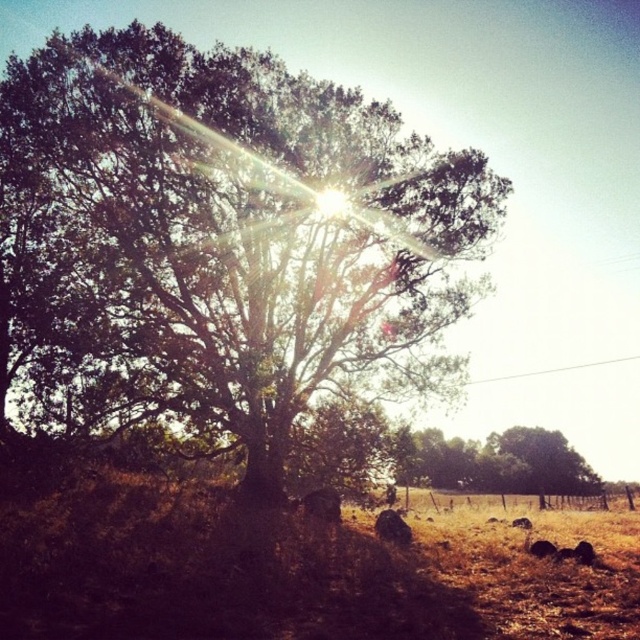
You are standing in the middle of the field and want to find shade quickly. Which tree, the green leafy tree at center or the green leafy tree at lower right, would provide more shade coverage?

The green leafy tree at center is taller than the green leafy tree at lower right, so it would provide more shade coverage.

You are standing in the rural landscape and want to pick up an object from the field. You can only reach objects that are closer to you. Which point would you choose between point [256,416] and point [518,486]?

Point [256,416] is closer to the camera than point [518,486], so you should choose point [256,416] because it is nearer and within reach.